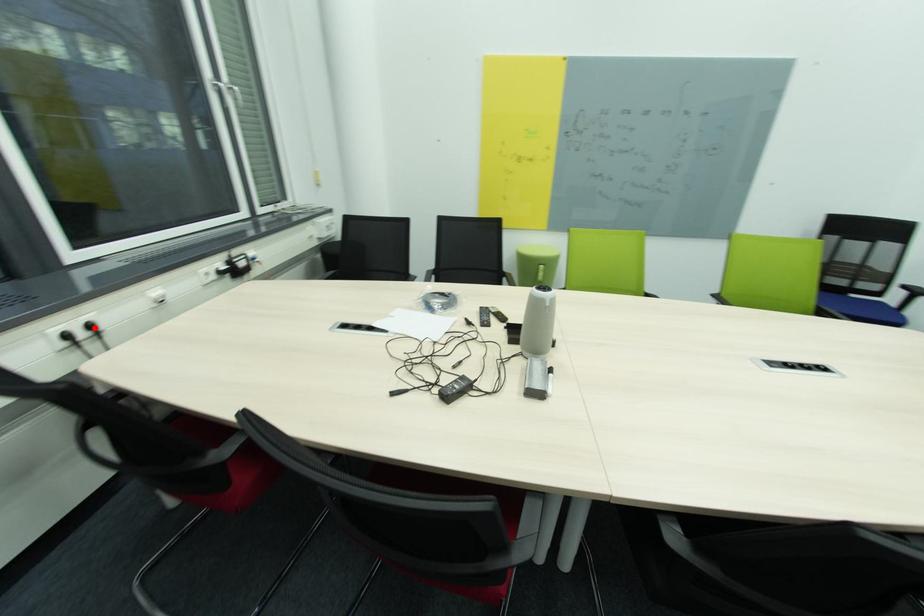
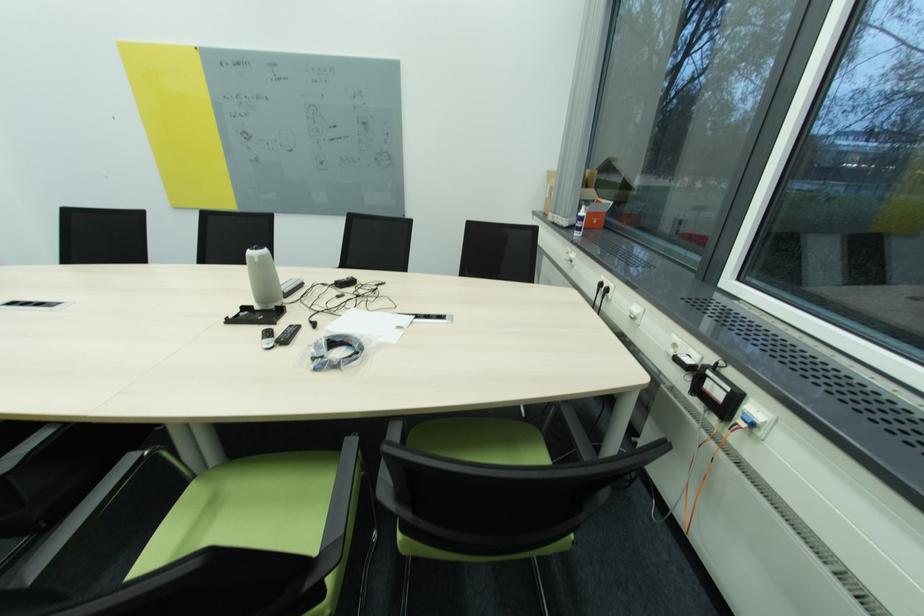
Question: A red point is marked in image1. In image2, is the corresponding 3D point closer to the camera or farther? Reply with the corresponding letter.

Choices:
 (A) The corresponding 3D point is closer.
 (B) The corresponding 3D point is farther.

Answer: (A)